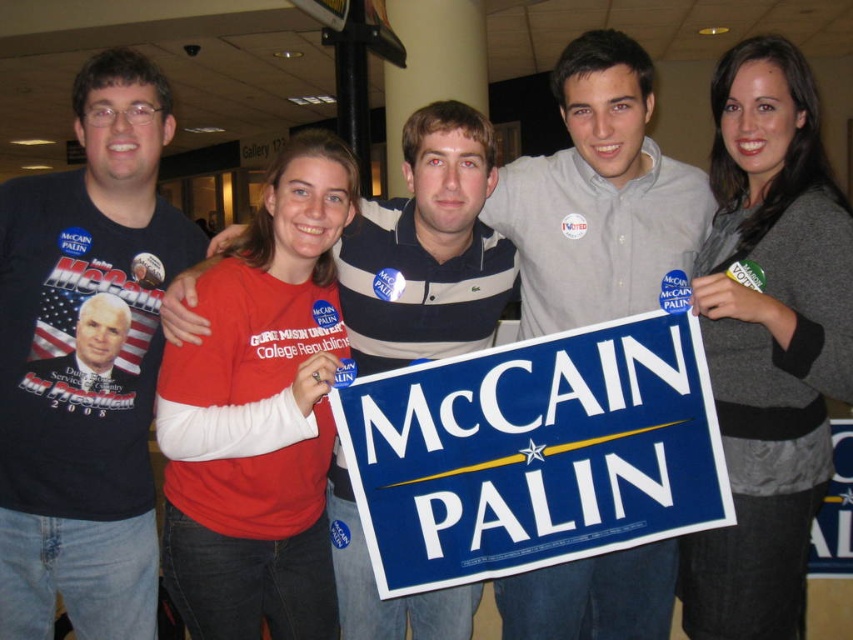
Can you confirm if matte black t-shirt at left is wider than gray sweater at upper right?

Indeed, matte black t-shirt at left has a greater width compared to gray sweater at upper right.

Is matte black t-shirt at left smaller than gray sweater at upper right?

Yes.

Is point (94, 193) positioned after point (814, 88)?

Yes, point (94, 193) is farther from viewer.

You are a GUI agent. You are given a task and a screenshot of the screen. Output one action in this format:
    pyautogui.click(x=<x>, y=<y>)
    Task: Click on the matte black t-shirt at left
    This screenshot has width=853, height=640.
    Given the screenshot: What is the action you would take?
    pyautogui.click(x=86, y=362)

Is gray sweater at upper right wider than red cotton shirt at center?

No.

Is gray sweater at upper right bigger than red cotton shirt at center?

Indeed, gray sweater at upper right has a larger size compared to red cotton shirt at center.

Measure the distance between gray sweater at upper right and camera.

gray sweater at upper right and camera are 1.77 meters apart from each other.

This screenshot has height=640, width=853. I want to click on gray sweater at upper right, so click(769, 340).

Can you confirm if matte black t-shirt at left is thinner than red cotton shirt at center?

Indeed, matte black t-shirt at left has a lesser width compared to red cotton shirt at center.

Is matte black t-shirt at left positioned behind red cotton shirt at center?

Yes, it is behind red cotton shirt at center.

This screenshot has height=640, width=853. Find the location of `matte black t-shirt at left`. matte black t-shirt at left is located at coordinates (86, 362).

I want to click on matte black t-shirt at left, so click(x=86, y=362).